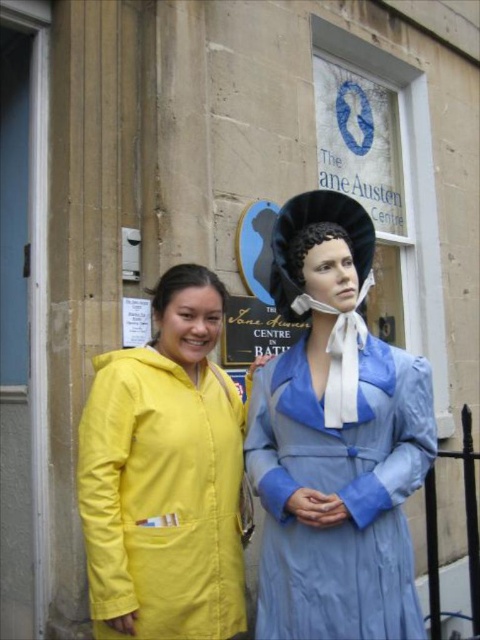
Can you confirm if yellow matte coat at center is thinner than light blue satin dress at center?

Yes, yellow matte coat at center is thinner than light blue satin dress at center.

Who is positioned more to the right, yellow matte coat at center or light blue satin dress at center?

From the viewer's perspective, light blue satin dress at center appears more on the right side.

Between point (132, 474) and point (343, 570), which one is positioned in front?

Point (343, 570) is in front.

Where is `yellow matte coat at center`? The height and width of the screenshot is (640, 480). yellow matte coat at center is located at coordinates (165, 476).